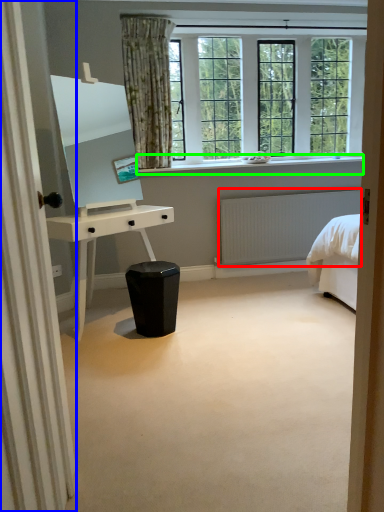
Question: Which object is the farthest from radiator (highlighted by a red box)? Choose among these: curtain (highlighted by a blue box) or window sill (highlighted by a green box).

Choices:
 (A) curtain
 (B) window sill

Answer: (A)